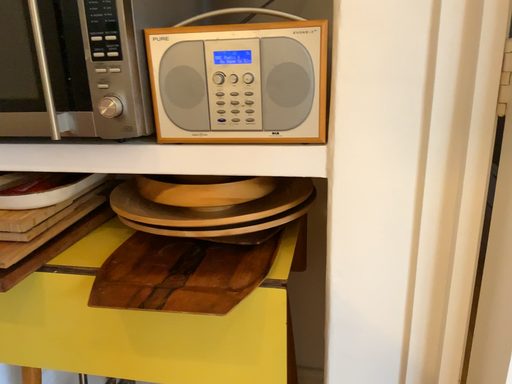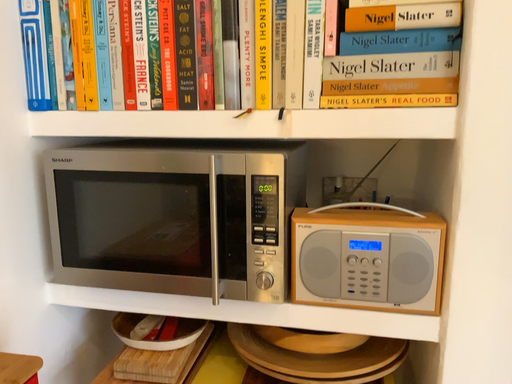
Question: How did the camera likely rotate when shooting the video?

Choices:
 (A) rotated downward
 (B) rotated upward

Answer: (B)